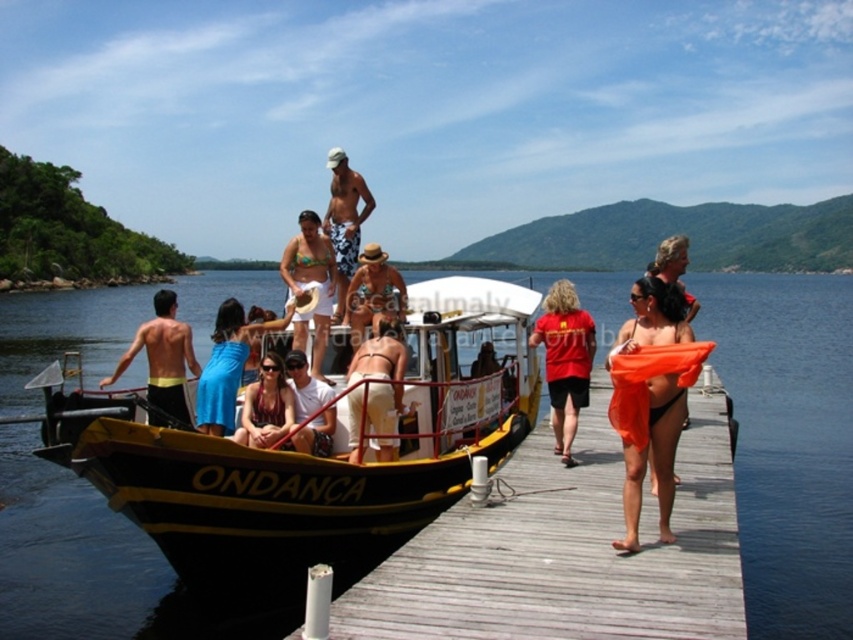
Does tan skin bikini at center appear over matte black bikini at center?

Indeed, tan skin bikini at center is positioned over matte black bikini at center.

What do you see at coordinates (381, 374) in the screenshot?
I see `tan skin bikini at center` at bounding box center [381, 374].

You are a GUI agent. You are given a task and a screenshot of the screen. Output one action in this format:
    pyautogui.click(x=<x>, y=<y>)
    Task: Click on the tan skin bikini at center
    The image size is (853, 640).
    Given the screenshot: What is the action you would take?
    pyautogui.click(x=381, y=374)

Is tan skin bikini at center further to camera compared to beige fabric hat at center?

No, it is not.

Does tan skin bikini at center appear over beige fabric hat at center?

Incorrect, tan skin bikini at center is not positioned above beige fabric hat at center.

Which is in front, point (399, 394) or point (314, 324)?

Point (399, 394) is more forward.

This screenshot has height=640, width=853. What are the coordinates of `tan skin bikini at center` in the screenshot? It's located at (381, 374).

Is orange fabric at center to the left of white cotton shirt at center from the viewer's perspective?

In fact, orange fabric at center is to the right of white cotton shirt at center.

Which is behind, point (630, 492) or point (310, 406)?

The point (310, 406) is behind.

Find the location of `orange fabric at center`. orange fabric at center is located at coordinates 648,449.